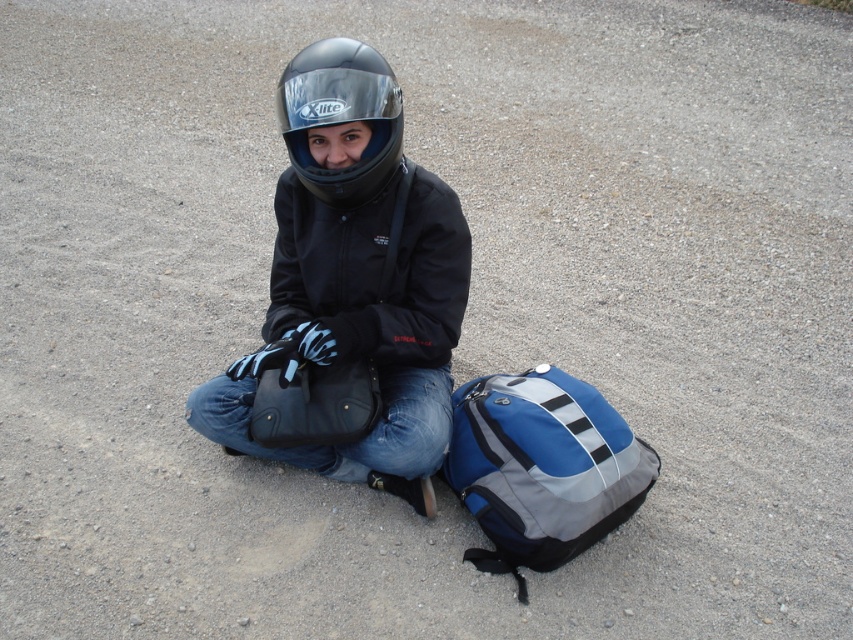
Is the position of black matte helmet at center more distant than that of matte black helmet at center?

No, it is in front of matte black helmet at center.

Describe the element at coordinates (352, 284) in the screenshot. Image resolution: width=853 pixels, height=640 pixels. I see `black matte helmet at center` at that location.

Between point (329, 180) and point (358, 182), which one is positioned behind?

Positioned behind is point (358, 182).

This screenshot has width=853, height=640. Find the location of `black matte helmet at center`. black matte helmet at center is located at coordinates (352, 284).

Who is more distant from viewer, (380, 170) or (480, 404)?

The point (480, 404) is behind.

Consider the image. Can you confirm if black matte helmet at center is smaller than blue fabric backpack at lower right?

Actually, black matte helmet at center might be larger than blue fabric backpack at lower right.

Find the location of a particular element. The width and height of the screenshot is (853, 640). black matte helmet at center is located at coordinates (352, 284).

Who is higher up, blue fabric backpack at lower right or matte black bag at center?

matte black bag at center

Looking at this image, which of these two, blue fabric backpack at lower right or matte black bag at center, stands taller?

With more height is blue fabric backpack at lower right.

Between point (621, 440) and point (357, 364), which one is positioned behind?

The point (357, 364) is more distant.

Locate an element on the screen. This screenshot has width=853, height=640. blue fabric backpack at lower right is located at coordinates (543, 467).